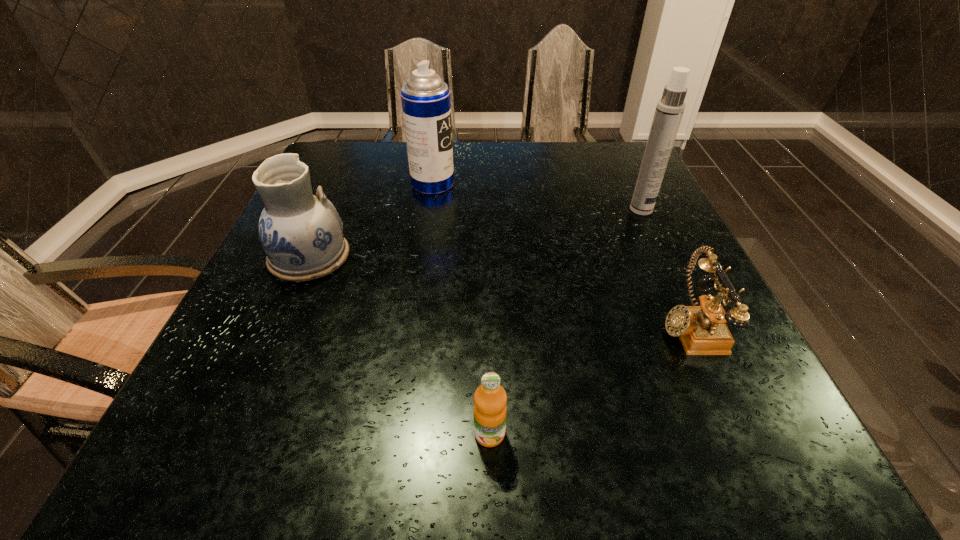
You are a GUI agent. You are given a task and a screenshot of the screen. Output one action in this format:
    pyautogui.click(x=<x>, y=<y>)
    Task: Click on the vacant region that satisfies the following two spatial constraints: 1. on the dial number of the second nearest object; 2. on the label of the nearest object
    The image size is (960, 540).
    Given the screenshot: What is the action you would take?
    pyautogui.click(x=737, y=434)

I want to click on vacant space that satisfies the following two spatial constraints: 1. on the label side of the farthest object; 2. on the right side of the nearer aerosol can, so click(429, 210).

Where is `vacant area that satisfies the following two spatial constraints: 1. on the back side of the right aerosol can; 2. on the right side of the leftmost object`? The image size is (960, 540). vacant area that satisfies the following two spatial constraints: 1. on the back side of the right aerosol can; 2. on the right side of the leftmost object is located at coordinates (330, 210).